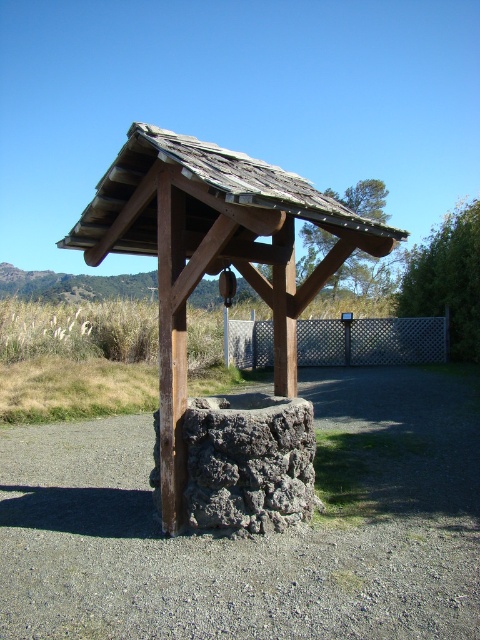
Question: Is rustic wood gazebo at center wider than weathered wood roof at center?

Choices:
 (A) yes
 (B) no

Answer: (B)

Question: Is rustic wood gazebo at center to the right of weathered wood roof at center from the viewer's perspective?

Choices:
 (A) no
 (B) yes

Answer: (A)

Question: Is rustic wood gazebo at center thinner than weathered wood roof at center?

Choices:
 (A) yes
 (B) no

Answer: (A)

Question: Which point appears closest to the camera in this image?

Choices:
 (A) (192, 214)
 (B) (229, 429)

Answer: (B)

Question: Which point is closer to the camera?

Choices:
 (A) (106, 202)
 (B) (96, 200)

Answer: (B)

Question: Which point is farther to the camera?

Choices:
 (A) (288, 173)
 (B) (126, 243)

Answer: (B)